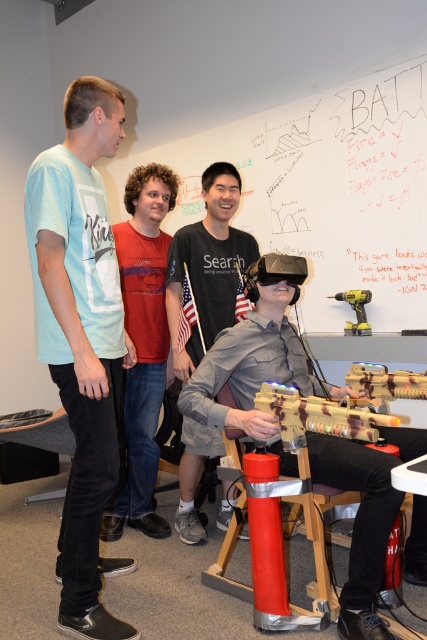
You are a fashion designer observing the scene. You notice a point located at coordinates [81,337]. Which object in the scene does this point belong to?

The point at coordinates [81,337] is on the light blue t shirt at left.

You are a game designer who needs to ensure that players can easily reach the camouflage fabric gun at center from the red cotton shirt at center. The minimum required distance for comfortable interaction is 3 feet. Is the current distance sufficient?

The distance between the red cotton shirt at center and the camouflage fabric gun at center is 3.55 feet, which exceeds the minimum required 3 feet, so the current distance is sufficient for comfortable interaction.